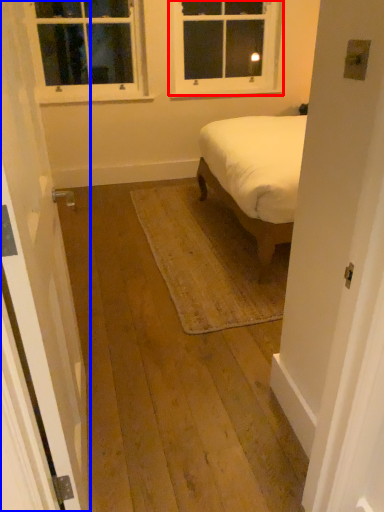
Question: Among these objects, which one is farthest to the camera, window (highlighted by a red box) or door (highlighted by a blue box)?

Choices:
 (A) window
 (B) door

Answer: (A)